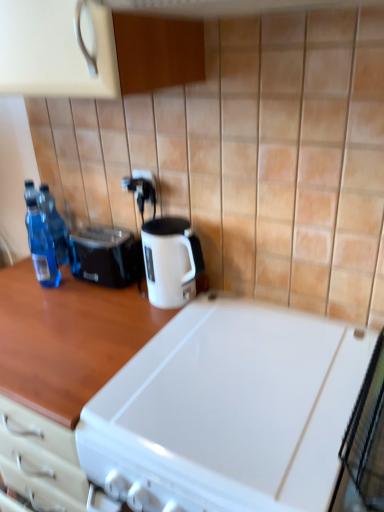
This screenshot has width=384, height=512. Find the location of `free space above woodenmaterial/texturecountertop at center, arranged as the 2th countertop when viewed from the right (from a real-world perspective)`. free space above woodenmaterial/texturecountertop at center, arranged as the 2th countertop when viewed from the right (from a real-world perspective) is located at coordinates (62, 310).